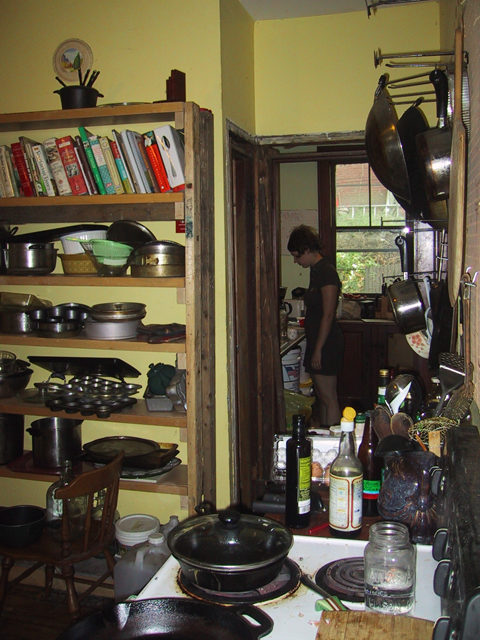
Identify the location of door. (258, 305).